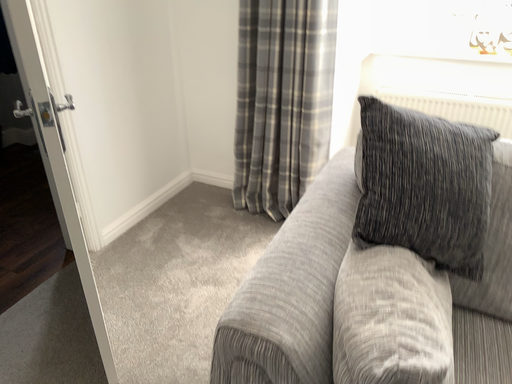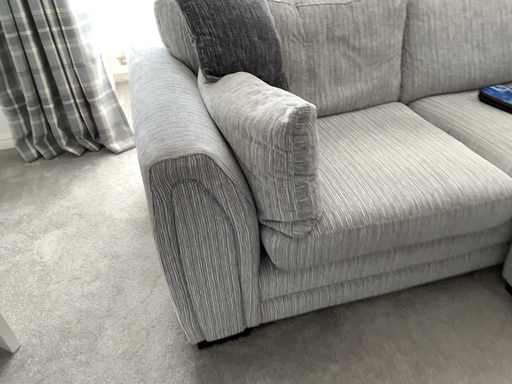
Question: How did the camera likely rotate when shooting the video?

Choices:
 (A) rotated left
 (B) rotated right

Answer: (B)